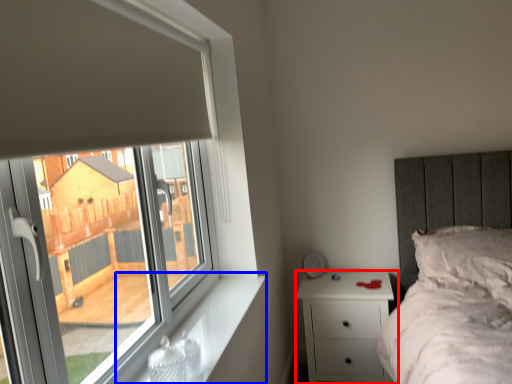
Question: Among these objects, which one is nearest to the camera, nightstand (highlighted by a red box) or window sill (highlighted by a blue box)?

Choices:
 (A) nightstand
 (B) window sill

Answer: (B)